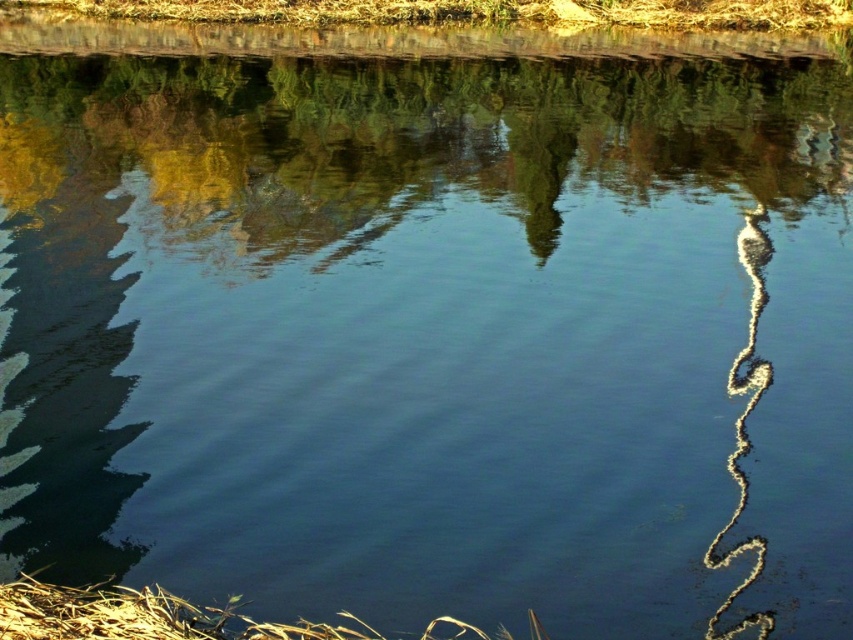
Looking at this image, you are standing at the edge of the water and see a point marked at coordinates (415, 138). Based on the scene description, what type of surface is the point located on?

The point at (415, 138) is located on smooth water at center.

You are standing at the edge of the water and want to throw a stone to hit both the smooth water at center and the brown grass at lower left. Given that the stone can travel 20 meters, will it reach both targets?

The smooth water at center is 18.68 meters away from brown grass at lower left. Since the stone can travel 20 meters, it will reach both targets as the distance between them is within the stone throw range.

You are standing at the edge of a lake and see the smooth water at center and brown grass at lower left. Which object is closer to you?

The brown grass at lower left is behind smooth water at center, so the smooth water at center is closer to you.